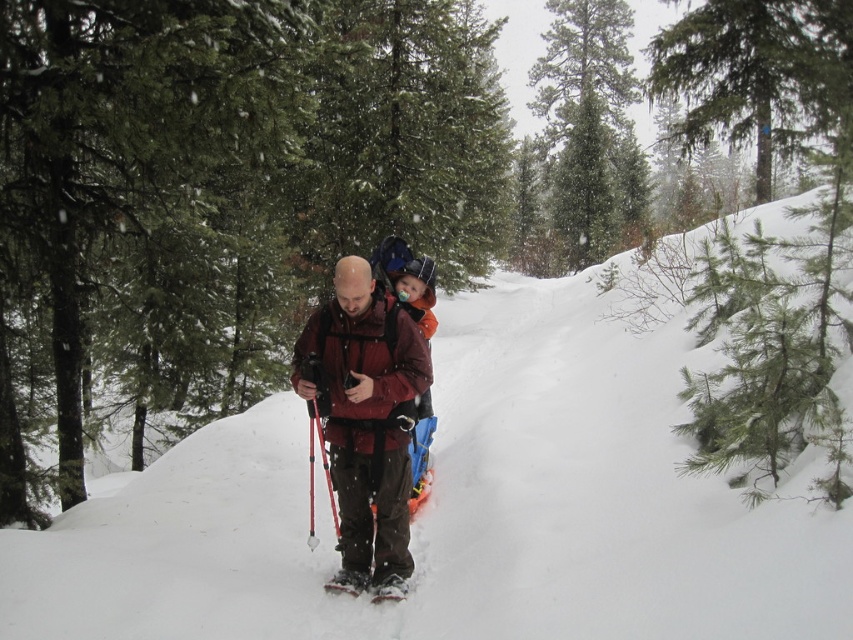
You are planning to take a photo of the matte red jacket at center in the snowy forest scene. Based on its position, where should you aim your camera?

The matte red jacket at center is located at point [366,412], so aim your camera at those coordinates to capture it.